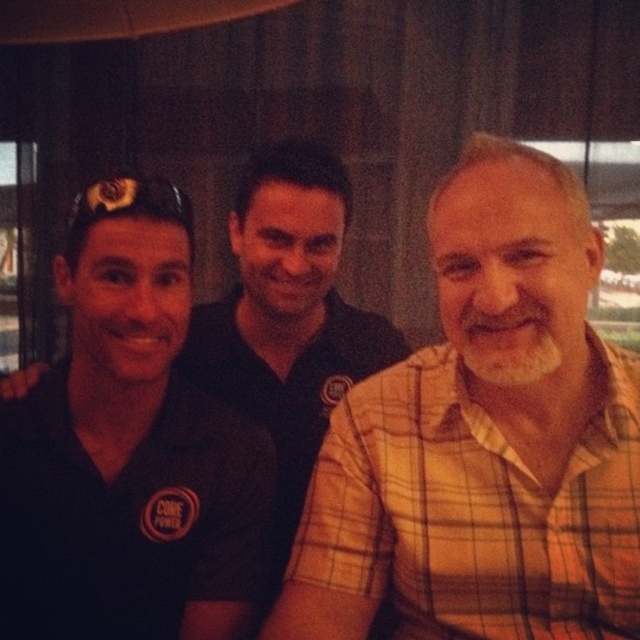
Question: Which point is closer to the camera?

Choices:
 (A) (291, 540)
 (B) (410, 570)

Answer: (B)

Question: Is plaid cotton shirt at center closer to camera compared to black matte shirt at center?

Choices:
 (A) no
 (B) yes

Answer: (B)

Question: Is plaid cotton shirt at center wider than black matte shirt at center?

Choices:
 (A) yes
 (B) no

Answer: (A)

Question: Which of the following is the closest to the observer?

Choices:
 (A) plaid cotton shirt at center
 (B) black matte shirt at center

Answer: (A)

Question: Does plaid cotton shirt at center have a smaller size compared to black matte shirt at center?

Choices:
 (A) no
 (B) yes

Answer: (B)